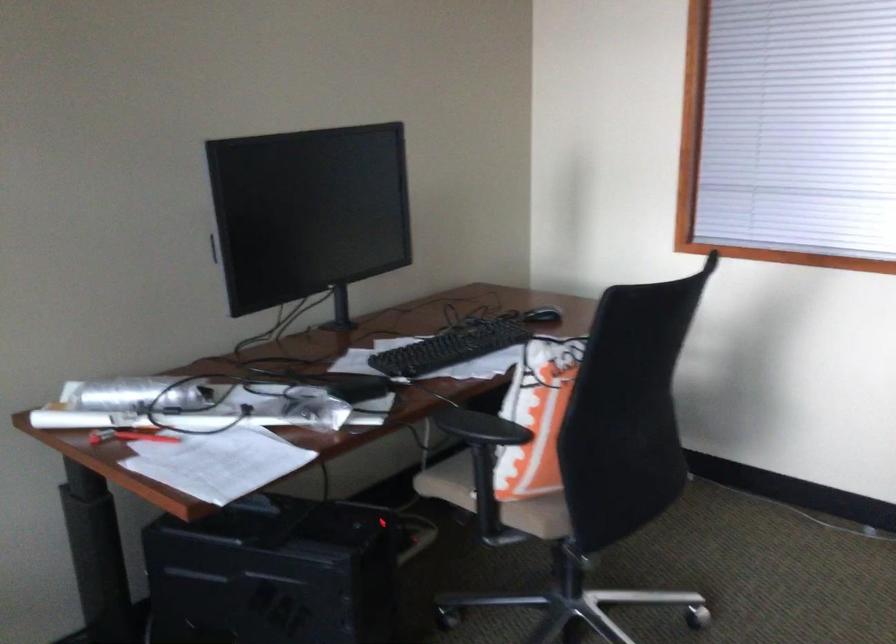
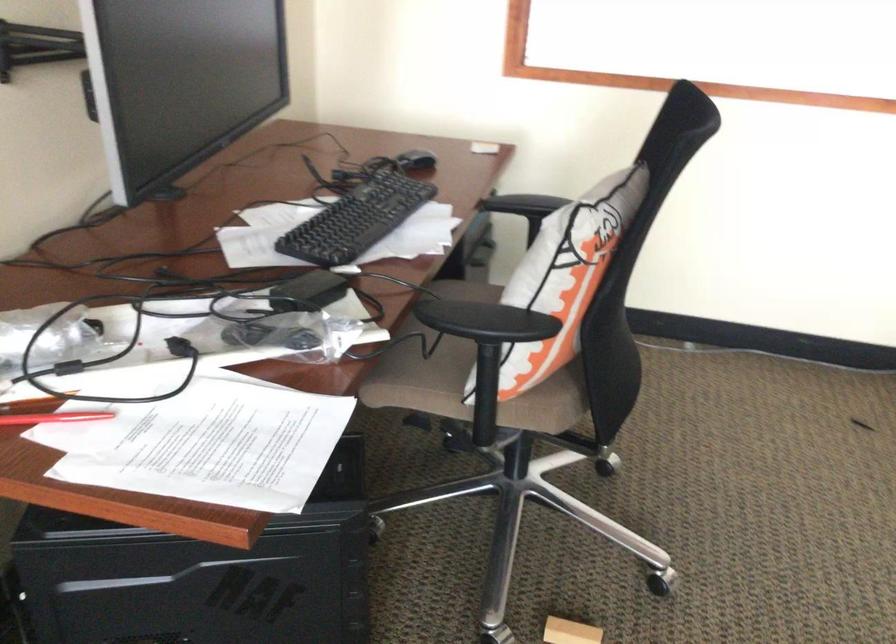
Find the pixel in the second image that matches (x=538, y=313) in the first image.

(416, 162)